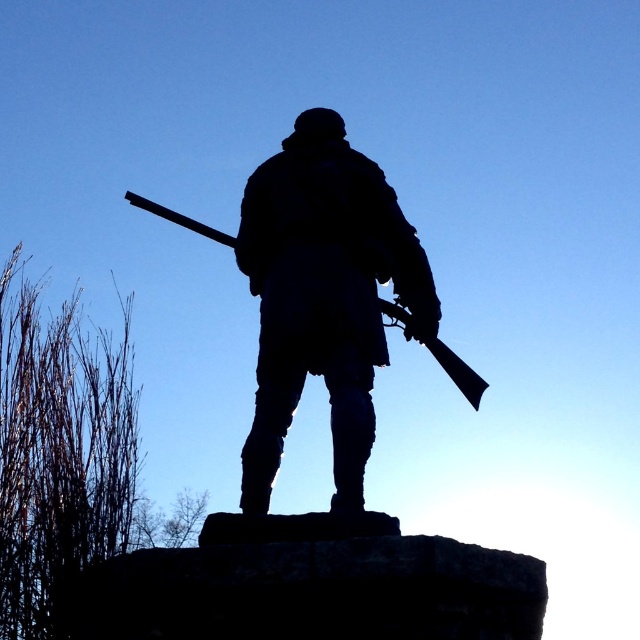
Is silhouette stone statue at center taller than silhouette wood shotgun at center?

Correct, silhouette stone statue at center is much taller as silhouette wood shotgun at center.

Is point (316, 371) closer to viewer compared to point (444, 356)?

Yes.

Is point (416, 298) positioned before point (470, 401)?

Yes, it is.

Locate an element on the screen. silhouette stone statue at center is located at coordinates (323, 296).